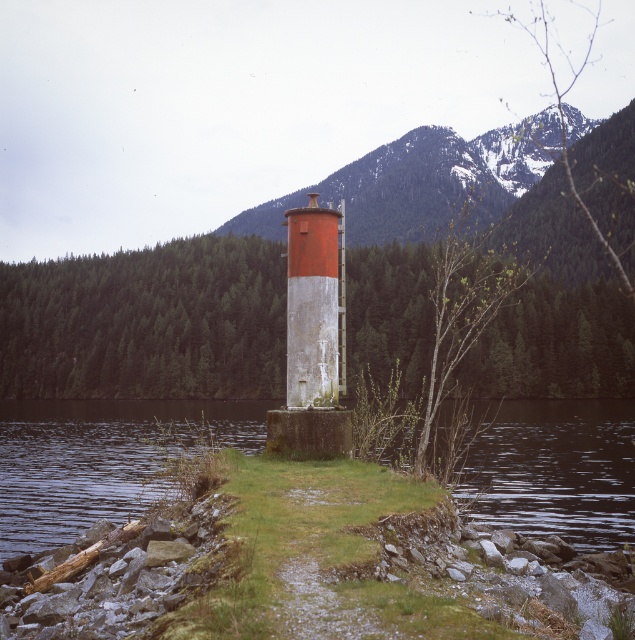
Question: Is clear water at lower center to the left of snowy rocky mountain at center from the viewer's perspective?

Choices:
 (A) yes
 (B) no

Answer: (A)

Question: Which object is farther from the camera taking this photo?

Choices:
 (A) clear water at lower center
 (B) snowy rocky mountain at center
 (C) red painted concrete tower at center

Answer: (B)

Question: Which point is farther from the camera taking this photo?

Choices:
 (A) (519, 440)
 (B) (331, 300)
 (C) (371, 227)

Answer: (C)

Question: Which point appears farthest from the camera in this image?

Choices:
 (A) (512, 173)
 (B) (483, 438)
 (C) (304, 304)

Answer: (A)

Question: Can you confirm if clear water at lower center is thinner than red painted concrete tower at center?

Choices:
 (A) yes
 (B) no

Answer: (B)

Question: Is snowy rocky mountain at center in front of red painted concrete tower at center?

Choices:
 (A) yes
 (B) no

Answer: (B)